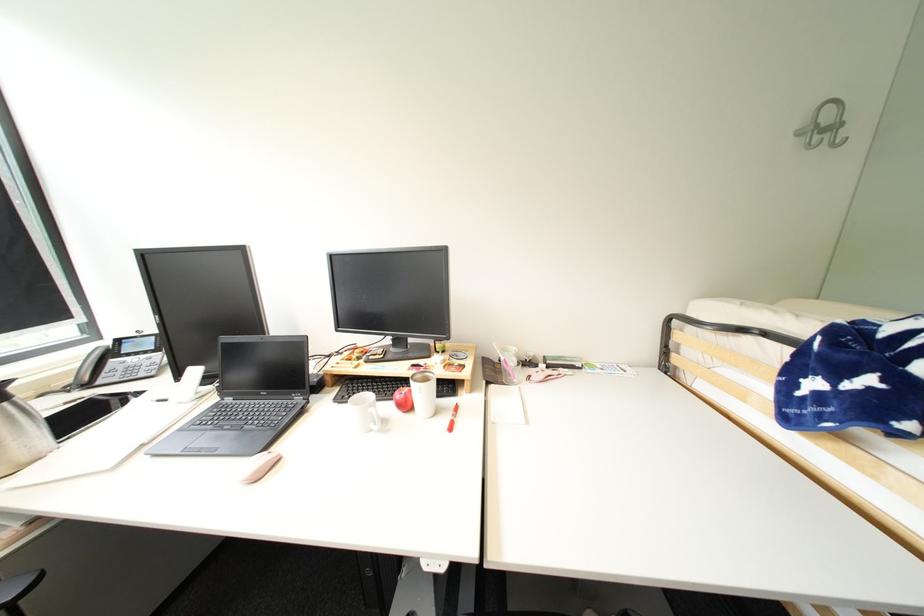
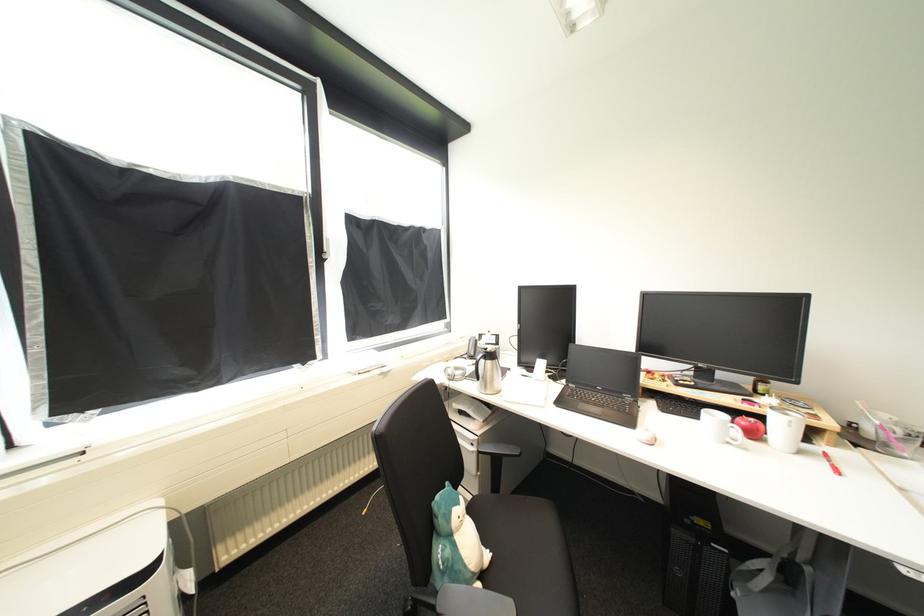
The point at (412, 408) is marked in the first image. Where is the corresponding point in the second image?

(761, 436)